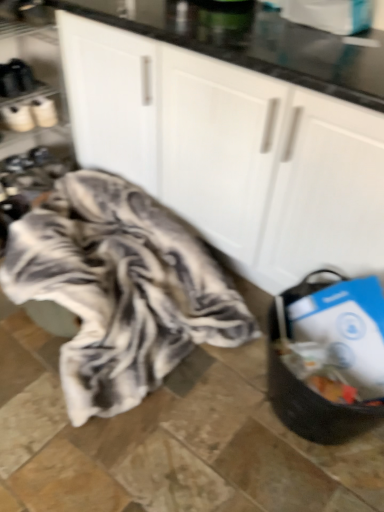
Question: From a real-world perspective, is black matte shoe rack at left over white matte cabinet at center?

Choices:
 (A) yes
 (B) no

Answer: (B)

Question: From the image's perspective, is black matte shoe rack at left below white matte cabinet at center?

Choices:
 (A) no
 (B) yes

Answer: (A)

Question: Is black matte shoe rack at left smaller than white matte cabinet at center?

Choices:
 (A) no
 (B) yes

Answer: (B)

Question: Considering the relative sizes of black matte shoe rack at left and white matte cabinet at center in the image provided, is black matte shoe rack at left taller than white matte cabinet at center?

Choices:
 (A) yes
 (B) no

Answer: (B)

Question: Is the depth of black matte shoe rack at left less than that of white matte cabinet at center?

Choices:
 (A) no
 (B) yes

Answer: (A)

Question: Is white matte cabinet at center inside black matte shoe rack at left?

Choices:
 (A) yes
 (B) no

Answer: (B)

Question: Is fluffy white blanket at center looking in the opposite direction of white matte cabinet at center?

Choices:
 (A) no
 (B) yes

Answer: (B)

Question: From the image's perspective, does fluffy white blanket at center appear lower than white matte cabinet at center?

Choices:
 (A) yes
 (B) no

Answer: (A)

Question: Can you confirm if fluffy white blanket at center is smaller than white matte cabinet at center?

Choices:
 (A) no
 (B) yes

Answer: (B)

Question: Is fluffy white blanket at center wider than white matte cabinet at center?

Choices:
 (A) no
 (B) yes

Answer: (B)

Question: Does fluffy white blanket at center have a larger size compared to white matte cabinet at center?

Choices:
 (A) no
 (B) yes

Answer: (A)

Question: Considering the relative positions of fluffy white blanket at center and white matte cabinet at center in the image provided, is fluffy white blanket at center in front of white matte cabinet at center?

Choices:
 (A) yes
 (B) no

Answer: (B)

Question: Considering the relative sizes of fluffy white blanket at center and black matte shoe rack at left in the image provided, is fluffy white blanket at center smaller than black matte shoe rack at left?

Choices:
 (A) no
 (B) yes

Answer: (A)